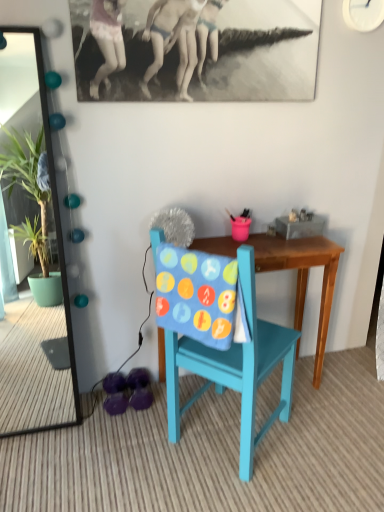
Question: Considering the positions of point (296, 246) and point (279, 340), is point (296, 246) closer or farther from the camera than point (279, 340)?

Choices:
 (A) closer
 (B) farther

Answer: (B)

Question: Based on their sizes in the image, would you say wooden table at center is bigger or smaller than teal painted wood chair at center?

Choices:
 (A) big
 (B) small

Answer: (B)

Question: Considering the real-world distances, which object is farthest from the wooden table at center?

Choices:
 (A) purple fabric footwear at lower left
 (B) teal painted wood chair at center
 (C) green glossy mirror at left

Answer: (C)

Question: Which is farther from the teal painted wood chair at center?

Choices:
 (A) wooden table at center
 (B) green glossy mirror at left
 (C) purple fabric footwear at lower left

Answer: (B)